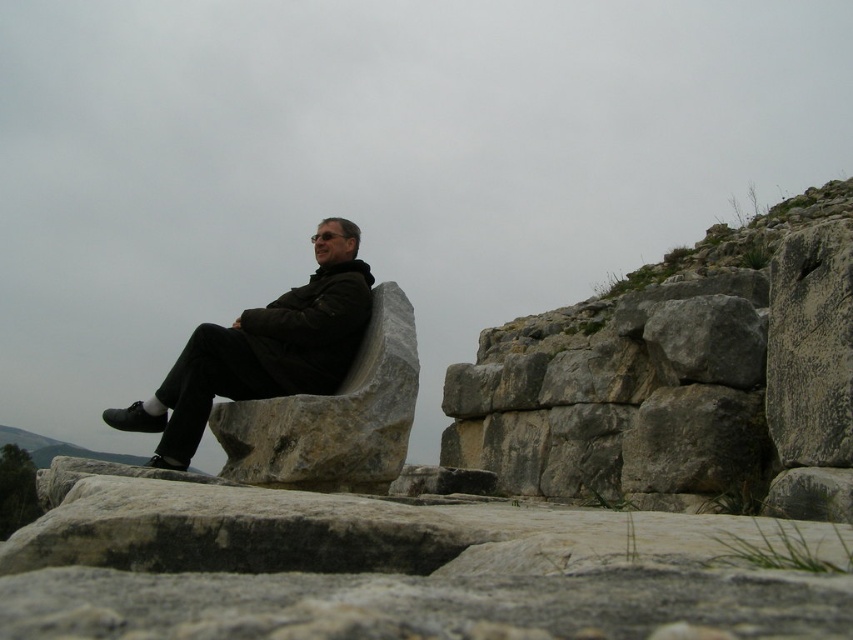
You are standing at the point labeled point (264, 412) and want to move towards the point labeled point (155, 454). Given the scene described, is the destination point in front of or behind your current position?

The destination point labeled point (155, 454) is behind your current position at point (264, 412) according to the spatial relationship provided.

Consider the image. You are a photographer trying to capture the man in the image. You want to ensure the matte black jacket at center and the gray stone boulder at center are both clearly visible in the frame. Given their sizes, which object should you focus on to ensure both are in focus?

The matte black jacket at center is wider than the gray stone boulder at center. To ensure both are in focus, you should focus on the matte black jacket at center since it is larger and might require more attention to detail.